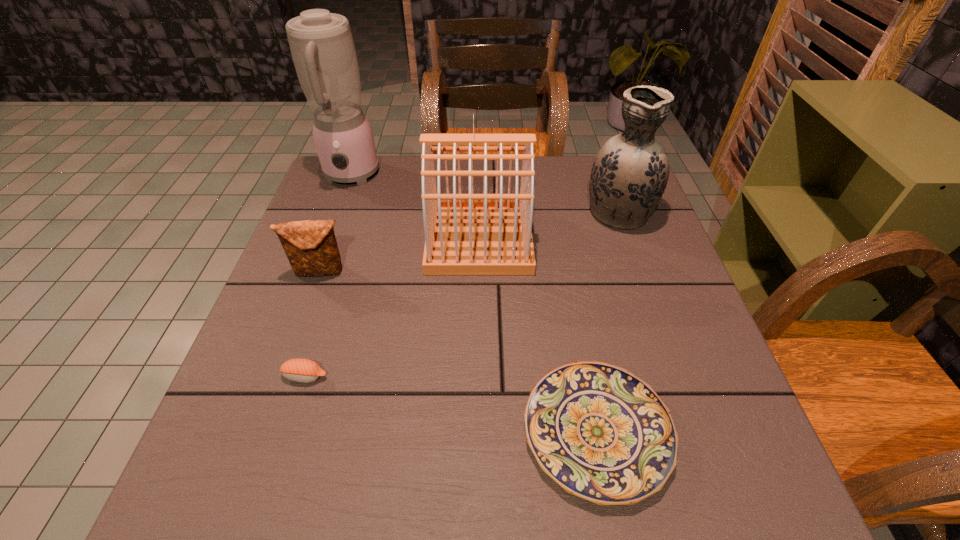
This screenshot has height=540, width=960. What are the coordinates of `food processor` in the screenshot? It's located at (322, 48).

What are the coordinates of `birdcage` in the screenshot? It's located at (465, 234).

Find the location of a particular element. This screenshot has width=960, height=540. vase is located at coordinates (629, 175).

At what (x,y) coordinates should I click in order to perform the action: click on the fourth tallest object. Please return your answer as a coordinate pair (x, y). Image resolution: width=960 pixels, height=540 pixels. Looking at the image, I should click on (311, 247).

Locate an element on the screen. The image size is (960, 540). the fifth tallest object is located at coordinates (301, 370).

Image resolution: width=960 pixels, height=540 pixels. Find the location of `plate`. plate is located at coordinates (601, 433).

In order to click on free space located on the base of the tallest object near the control knob in this screenshot , I will do `click(326, 244)`.

The image size is (960, 540). Find the location of `free space located 0.140m with an open door on the birdcage`. free space located 0.140m with an open door on the birdcage is located at coordinates (587, 239).

Identify the location of vacant space located 0.150m with the handle on the side of the vase. This screenshot has height=540, width=960. pos(600,160).

Locate an element on the screen. free space located 0.100m on the open side of the clutch bag is located at coordinates (305, 316).